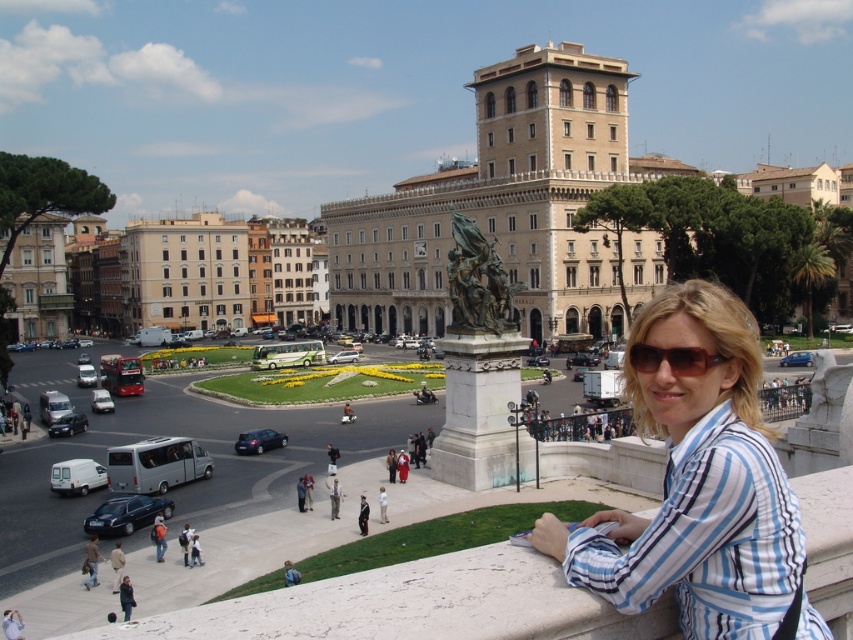
Question: Is brown leather jacket at lower left wider than light beige pants at lower center?

Choices:
 (A) yes
 (B) no

Answer: (A)

Question: Is brown matte sunglasses at center further to the viewer compared to light brown leather jacket at lower center?

Choices:
 (A) no
 (B) yes

Answer: (A)

Question: Which point appears closest to the camera in this image?

Choices:
 (A) 579,580
 (B) 440,202
 (C) 126,582

Answer: (A)

Question: Which point is farther to the camera?

Choices:
 (A) pos(386,506)
 (B) pos(640,545)
 (C) pos(154,544)
 (D) pos(366,515)

Answer: (A)

Question: Which point is closer to the camera?

Choices:
 (A) (381, 492)
 (B) (729, 634)

Answer: (B)

Question: Does blue striped shirt at center have a larger size compared to dark blue uniform at lower center?

Choices:
 (A) yes
 (B) no

Answer: (A)